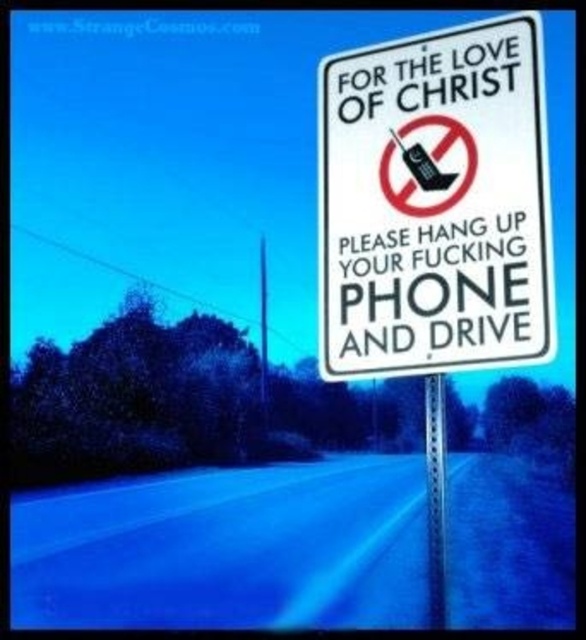
Question: Which point is farther to the camera?

Choices:
 (A) (434, 460)
 (B) (471, 45)

Answer: (B)

Question: In this image, where is white paper sign at upper right located relative to metallic silver pole at center-right?

Choices:
 (A) right
 (B) left

Answer: (B)

Question: Does white paper sign at upper right have a lesser width compared to metallic silver pole at center-right?

Choices:
 (A) yes
 (B) no

Answer: (A)

Question: Is white paper sign at upper right wider than metallic silver pole at center-right?

Choices:
 (A) yes
 (B) no

Answer: (B)